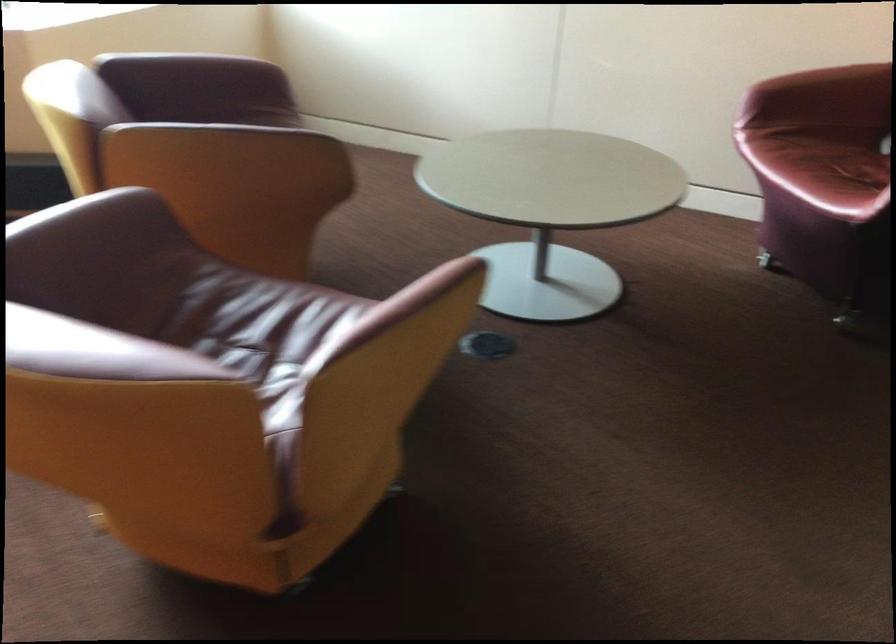
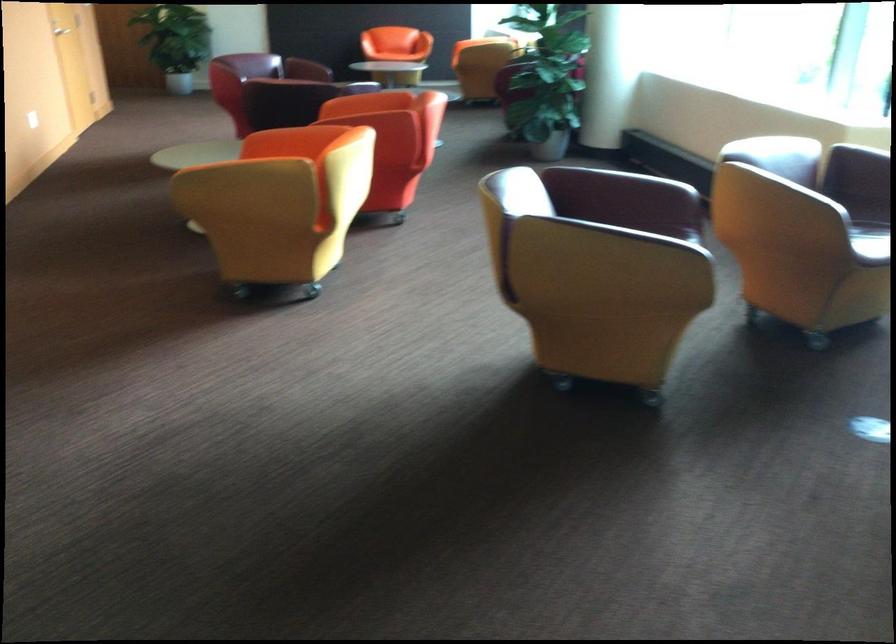
Question: I am providing you with two images of the same scene from different viewpoints. Which of the following objects are not visible in image2?

Choices:
 (A) orange chair sitting surface
 (B) red lighter
 (C) purple chair sitting surface
 (D) brown chair sitting surface

Answer: (D)